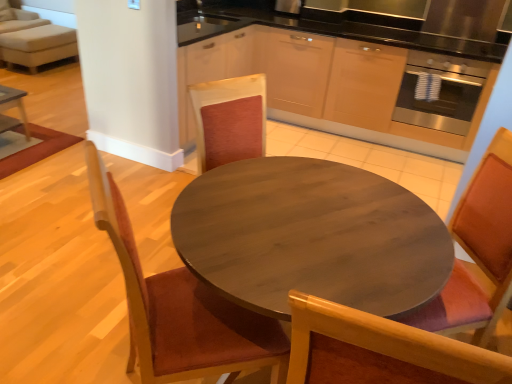
Question: Is wooden table at center outside wooden chair at left, placed as the second chair when sorted from right to left?

Choices:
 (A) yes
 (B) no

Answer: (A)

Question: Can you see wooden table at center touching wooden chair at left, the 1th chair viewed from the left?

Choices:
 (A) yes
 (B) no

Answer: (B)

Question: From a real-world perspective, does wooden table at center sit lower than wooden chair at left, placed as the second chair when sorted from right to left?

Choices:
 (A) yes
 (B) no

Answer: (A)

Question: Is wooden table at center bigger than wooden chair at left, placed as the second chair when sorted from right to left?

Choices:
 (A) yes
 (B) no

Answer: (A)

Question: Is wooden chair at left, placed as the second chair when sorted from right to left, completely or partially inside wooden table at center?

Choices:
 (A) no
 (B) yes

Answer: (B)

Question: Does wooden table at center appear on the left side of wooden chair at left, the 1th chair viewed from the left?

Choices:
 (A) yes
 (B) no

Answer: (B)

Question: Is light beige fabric couch at upper left not near wooden chair at left, the 1th chair viewed from the left?

Choices:
 (A) yes
 (B) no

Answer: (A)

Question: From a real-world perspective, is light beige fabric couch at upper left located beneath wooden chair at left, placed as the second chair when sorted from right to left?

Choices:
 (A) yes
 (B) no

Answer: (A)

Question: Can you confirm if light beige fabric couch at upper left is smaller than wooden chair at left, placed as the second chair when sorted from right to left?

Choices:
 (A) no
 (B) yes

Answer: (A)

Question: From a real-world perspective, does light beige fabric couch at upper left stand above wooden chair at left, the 1th chair viewed from the left?

Choices:
 (A) no
 (B) yes

Answer: (A)

Question: Is light beige fabric couch at upper left facing away from wooden chair at left, placed as the second chair when sorted from right to left?

Choices:
 (A) no
 (B) yes

Answer: (A)

Question: Can you confirm if light beige fabric couch at upper left is shorter than wooden chair at left, placed as the second chair when sorted from right to left?

Choices:
 (A) no
 (B) yes

Answer: (B)

Question: Could you tell me if wooden chair at center, the 2th chair from the left, is facing wooden chair at left, placed as the second chair when sorted from right to left?

Choices:
 (A) no
 (B) yes

Answer: (B)